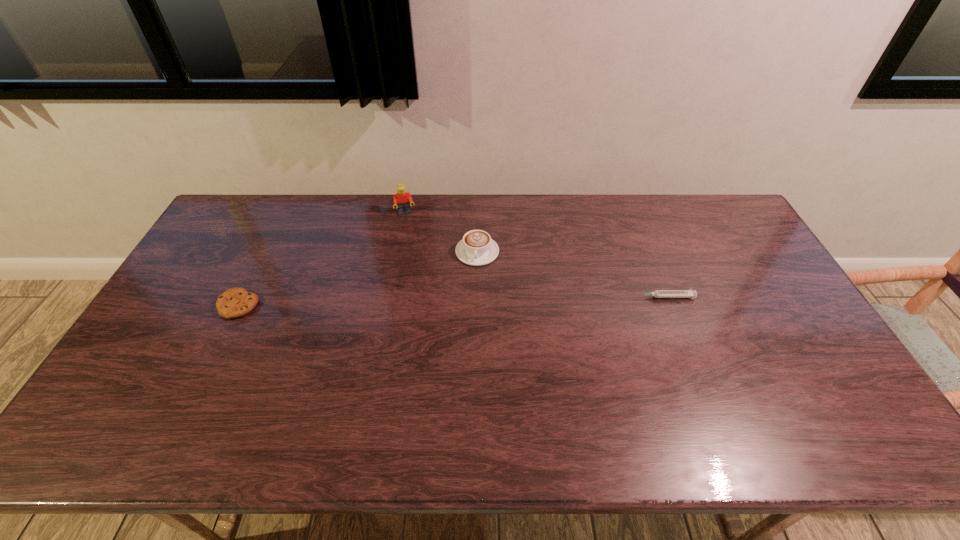
Identify the location of vacant spot on the desktop that is between the leftmost object and the shortest object and is positioned with the handle on the right side of the cappuccino. (479, 301).

The image size is (960, 540). What are the coordinates of `free space on the desktop that is between the cookie and the syringe and is positioned on the face of the tallest object` in the screenshot? It's located at (424, 302).